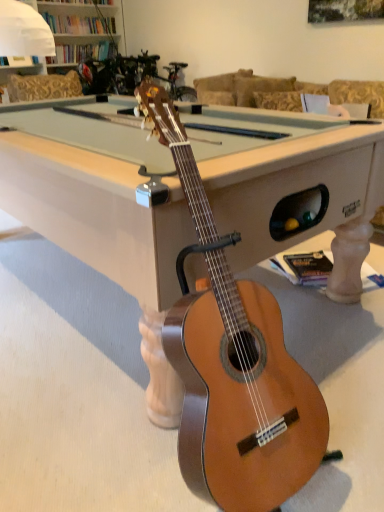
Question: Is natural wood guitar at center smaller than light wood billiard table at center?

Choices:
 (A) no
 (B) yes

Answer: (B)

Question: Is natural wood guitar at center positioned with its back to light wood billiard table at center?

Choices:
 (A) no
 (B) yes

Answer: (A)

Question: From a real-world perspective, does natural wood guitar at center sit lower than light wood billiard table at center?

Choices:
 (A) yes
 (B) no

Answer: (B)

Question: Is natural wood guitar at center thinner than light wood billiard table at center?

Choices:
 (A) no
 (B) yes

Answer: (B)

Question: Does natural wood guitar at center have a lesser height compared to light wood billiard table at center?

Choices:
 (A) no
 (B) yes

Answer: (A)

Question: Is natural wood guitar at center facing towards light wood billiard table at center?

Choices:
 (A) no
 (B) yes

Answer: (A)

Question: Would you say light wood billiard table at center contains natural wood guitar at center?

Choices:
 (A) no
 (B) yes

Answer: (A)

Question: Does light wood billiard table at center lie behind natural wood guitar at center?

Choices:
 (A) yes
 (B) no

Answer: (A)

Question: Is light wood billiard table at center with natural wood guitar at center?

Choices:
 (A) yes
 (B) no

Answer: (B)

Question: From the image's perspective, does light wood billiard table at center appear higher than natural wood guitar at center?

Choices:
 (A) no
 (B) yes

Answer: (B)

Question: From the image's perspective, is light wood billiard table at center under natural wood guitar at center?

Choices:
 (A) no
 (B) yes

Answer: (A)

Question: Is light wood billiard table at center far from natural wood guitar at center?

Choices:
 (A) yes
 (B) no

Answer: (B)

Question: Based on their positions, is natural wood guitar at center located to the left or right of light wood billiard table at center?

Choices:
 (A) left
 (B) right

Answer: (B)